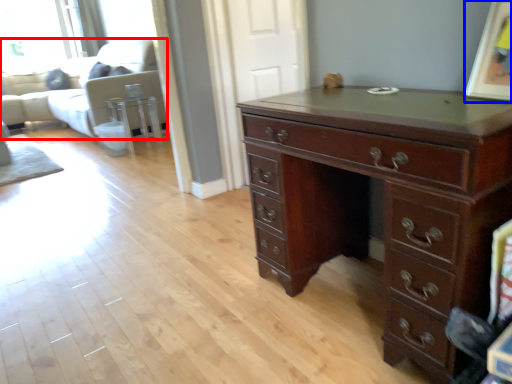
Question: Which object is closer to the camera taking this photo, couch (highlighted by a red box) or picture frame (highlighted by a blue box)?

Choices:
 (A) couch
 (B) picture frame

Answer: (B)